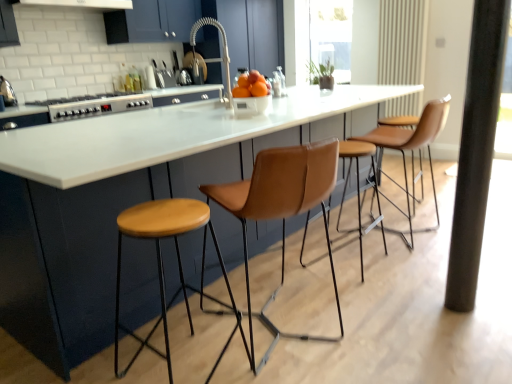
Question: Is transparent glass window screen at upper center in front of silver metallic stove at left?

Choices:
 (A) no
 (B) yes

Answer: (A)

Question: From the image's perspective, is transparent glass window screen at upper center above silver metallic stove at left?

Choices:
 (A) yes
 (B) no

Answer: (A)

Question: From the image's perspective, would you say transparent glass window screen at upper center is shown under silver metallic stove at left?

Choices:
 (A) no
 (B) yes

Answer: (A)

Question: Is transparent glass window screen at upper center positioned with its back to silver metallic stove at left?

Choices:
 (A) yes
 (B) no

Answer: (B)

Question: From a real-world perspective, is transparent glass window screen at upper center on silver metallic stove at left?

Choices:
 (A) yes
 (B) no

Answer: (A)

Question: From the image's perspective, is wooden stool at center located above or below black matte pillar at right?

Choices:
 (A) above
 (B) below

Answer: (B)

Question: From a real-world perspective, is wooden stool at center positioned above or below black matte pillar at right?

Choices:
 (A) above
 (B) below

Answer: (B)

Question: Considering the positions of wooden stool at center and black matte pillar at right in the image, is wooden stool at center wider or thinner than black matte pillar at right?

Choices:
 (A) thin
 (B) wide

Answer: (B)

Question: Based on their positions, is wooden stool at center located to the left or right of black matte pillar at right?

Choices:
 (A) right
 (B) left

Answer: (B)

Question: Considering the positions of point (222, 61) and point (249, 365), is point (222, 61) closer or farther from the camera than point (249, 365)?

Choices:
 (A) closer
 (B) farther

Answer: (B)

Question: Looking at the image, does satin nickel faucet at center seem bigger or smaller compared to wooden stool at center?

Choices:
 (A) small
 (B) big

Answer: (A)

Question: Is satin nickel faucet at center in front of or behind wooden stool at center in the image?

Choices:
 (A) front
 (B) behind

Answer: (B)

Question: Would you say satin nickel faucet at center is to the left or to the right of wooden stool at center in the picture?

Choices:
 (A) right
 (B) left

Answer: (A)

Question: Is point (224, 41) positioned closer to the camera than point (76, 99)?

Choices:
 (A) farther
 (B) closer

Answer: (A)

Question: From a real-world perspective, is satin nickel faucet at center positioned above or below silver metallic stove at left?

Choices:
 (A) below
 (B) above

Answer: (B)